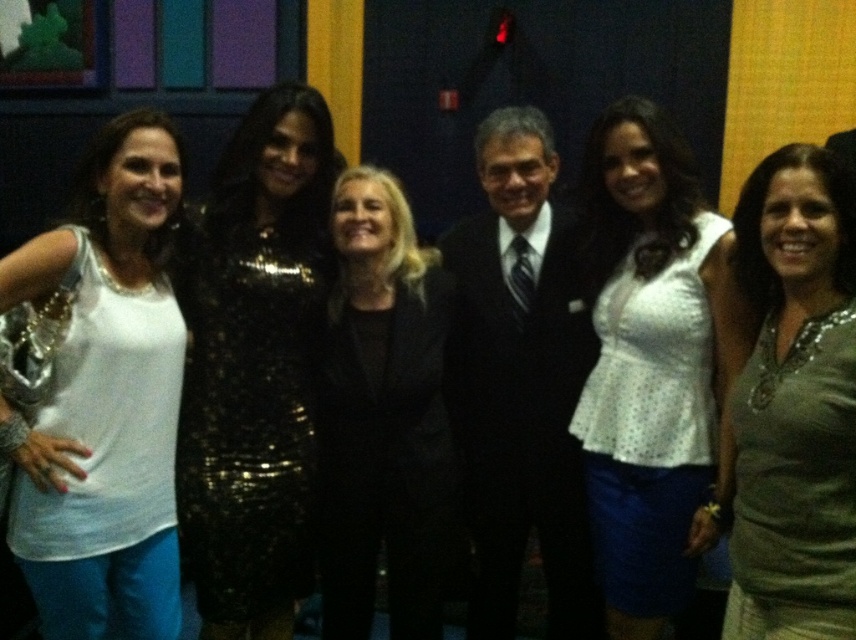
Question: Which point is farther to the camera?

Choices:
 (A) (42, 461)
 (B) (271, 289)

Answer: (B)

Question: Which point is closer to the camera?

Choices:
 (A) (622, 490)
 (B) (611, 410)
 (C) (753, 515)

Answer: (C)

Question: Is black suit at center positioned in front of green jersey at center?

Choices:
 (A) no
 (B) yes

Answer: (A)

Question: Is white dotted blouse at center thinner than shiny black dress at center?

Choices:
 (A) yes
 (B) no

Answer: (A)

Question: Which object is the farthest from the white dotted fabric dress at center?

Choices:
 (A) white sequined dress at left
 (B) white dotted blouse at center
 (C) black suit at center

Answer: (A)

Question: Can you confirm if green jersey at center is positioned above shiny black dress at center?

Choices:
 (A) no
 (B) yes

Answer: (B)